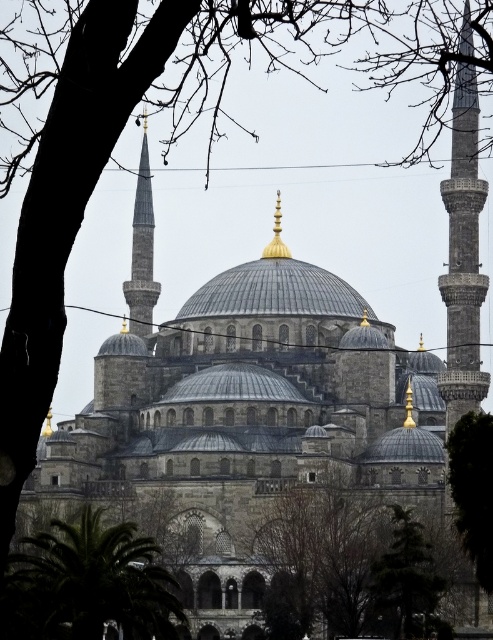
Question: Which object appears farthest from the camera in this image?

Choices:
 (A) smooth stone minaret at upper left
 (B) green textured tree at lower right
 (C) green leafy tree at lower left

Answer: (A)

Question: Is green leafy tree at lower left bigger than smooth stone minaret at upper left?

Choices:
 (A) no
 (B) yes

Answer: (B)

Question: Which of these objects is positioned farthest from the green leafy tree at lower right?

Choices:
 (A) green textured tree at lower right
 (B) green leafy tree at lower left
 (C) gray stone minaret at right

Answer: (B)

Question: From the image, what is the correct spatial relationship of green leafy tree at lower right in relation to green textured tree at lower right?

Choices:
 (A) below
 (B) above

Answer: (B)

Question: Which of the following is the farthest from the observer?

Choices:
 (A) smooth stone minaret at upper left
 (B) green textured tree at lower right
 (C) green leafy tree at lower left

Answer: (A)

Question: Considering the relative positions of gray stone minaret at right and green textured tree at lower right in the image provided, where is gray stone minaret at right located with respect to green textured tree at lower right?

Choices:
 (A) above
 (B) below

Answer: (A)